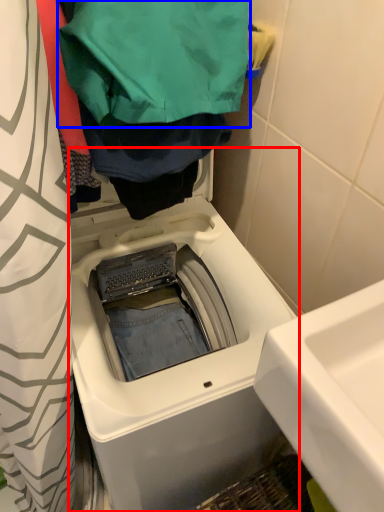
Question: Which of the following is the closest to the observer, washing machine (highlighted by a red box) or clothing (highlighted by a blue box)?

Choices:
 (A) washing machine
 (B) clothing

Answer: (B)